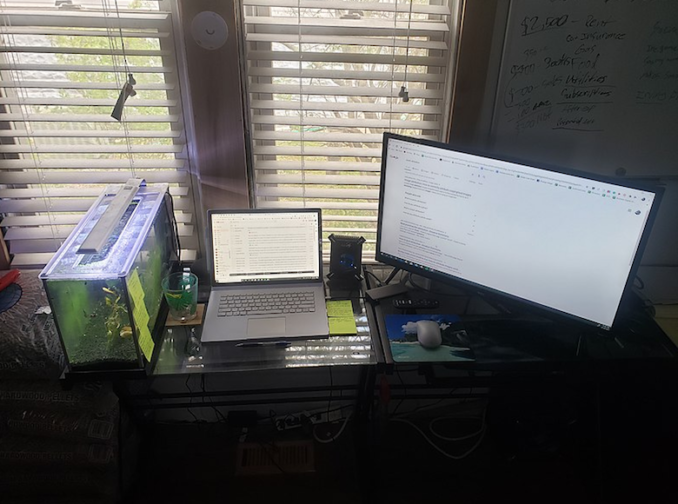
You are a GUI agent. You are given a task and a screenshot of the screen. Output one action in this format:
    pyautogui.click(x=<x>, y=<y>)
    Task: Click on the aquarium light
    
    Given the screenshot: What is the action you would take?
    pyautogui.click(x=106, y=215)